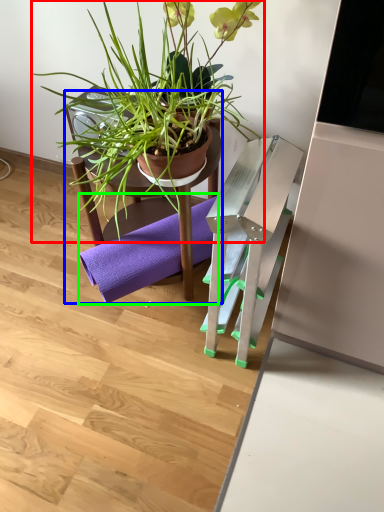
Question: Which is nearer to the houseplant (highlighted by a red box)? chair (highlighted by a blue box) or yoga mat (highlighted by a green box).

Choices:
 (A) chair
 (B) yoga mat

Answer: (A)